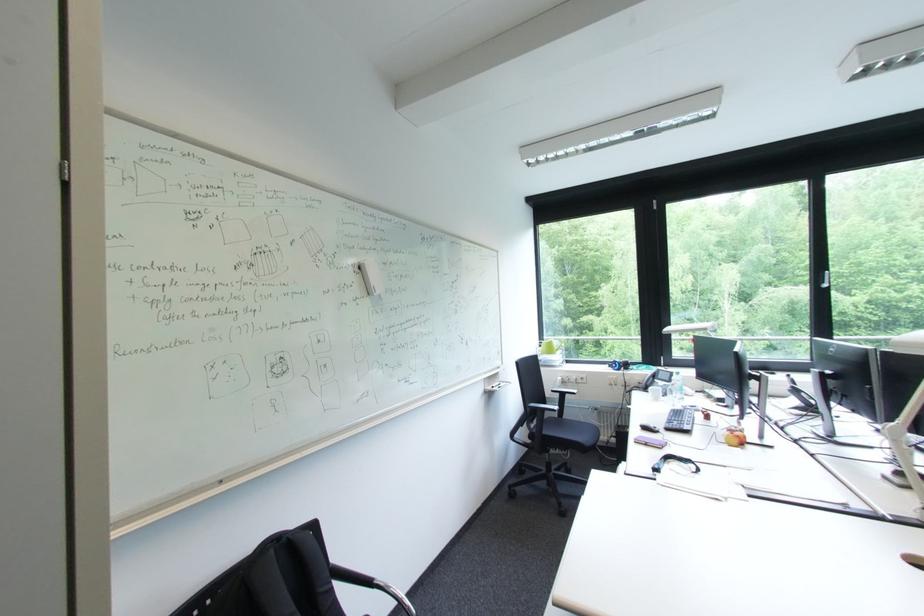
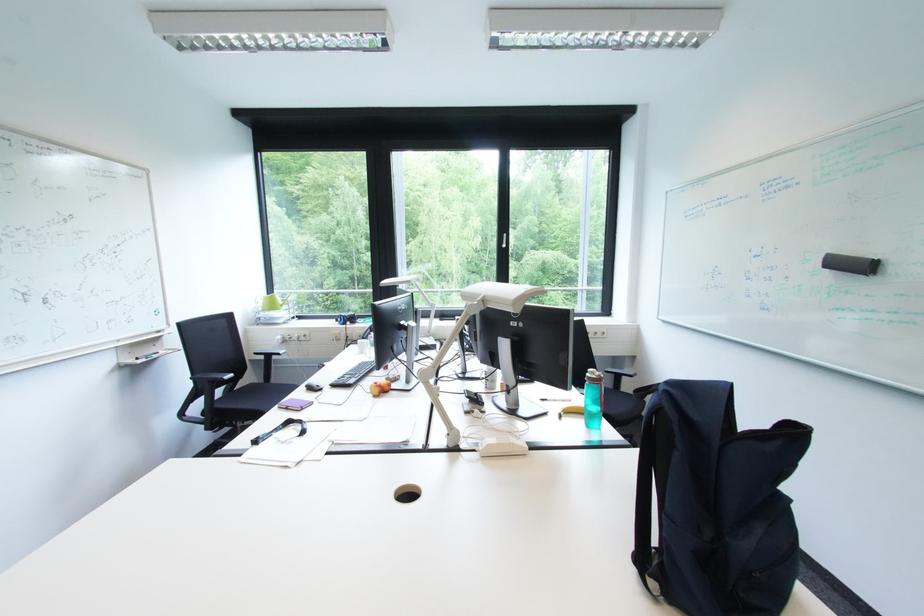
The point at (567,395) is marked in the first image. Where is the corresponding point in the second image?

(273, 358)